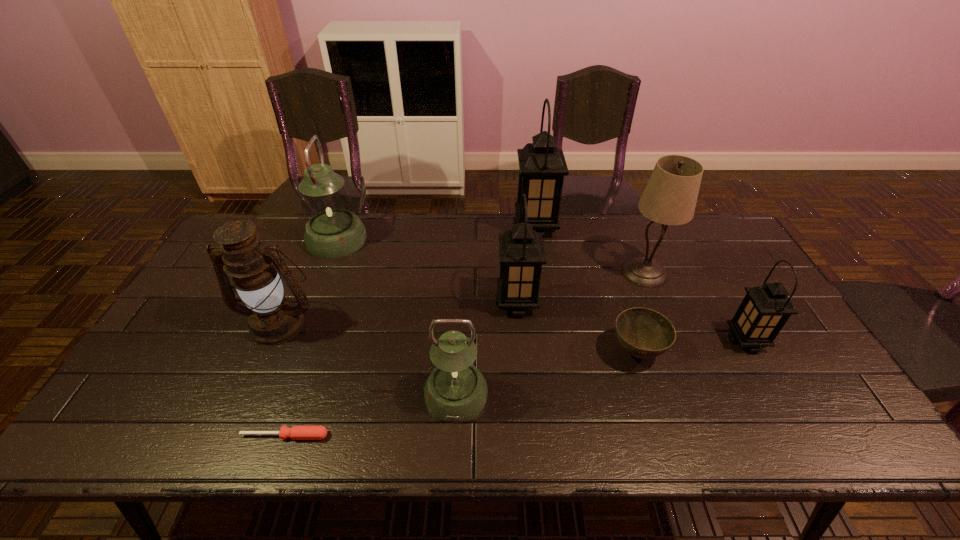
Image resolution: width=960 pixels, height=540 pixels. Find the location of `the tallest lantern`. the tallest lantern is located at coordinates (542, 166).

Where is `the farthest black lantern`? The height and width of the screenshot is (540, 960). the farthest black lantern is located at coordinates (542, 166).

The height and width of the screenshot is (540, 960). I want to click on lampshade, so click(x=670, y=196).

Where is `the bigger greenish lantern`? This screenshot has height=540, width=960. the bigger greenish lantern is located at coordinates (333, 231).

At what (x,y) coordinates should I click in order to perform the action: click on the farther greenish lantern. Please return your answer as a coordinate pair (x, y). Looking at the image, I should click on click(x=333, y=231).

This screenshot has height=540, width=960. Find the location of `the second farthest black lantern`. the second farthest black lantern is located at coordinates (521, 251).

I want to click on the second biggest black lantern, so point(521,251).

Where is `oil lamp`? oil lamp is located at coordinates (273, 319).

The image size is (960, 540). In order to click on the second nearest lantern in this screenshot , I will do (765, 309).

Where is `the rightmost object`? This screenshot has height=540, width=960. the rightmost object is located at coordinates point(765,309).